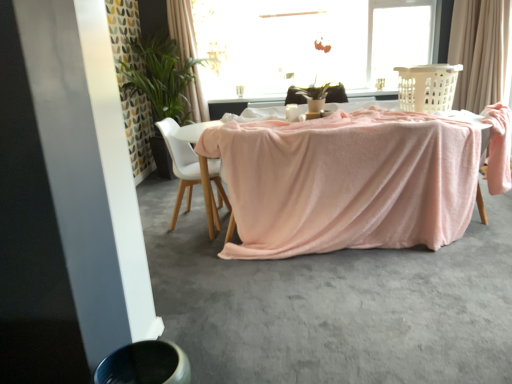
This screenshot has width=512, height=384. Find the location of `vacant space in front of pink fabric armchair at right`. vacant space in front of pink fabric armchair at right is located at coordinates (487, 239).